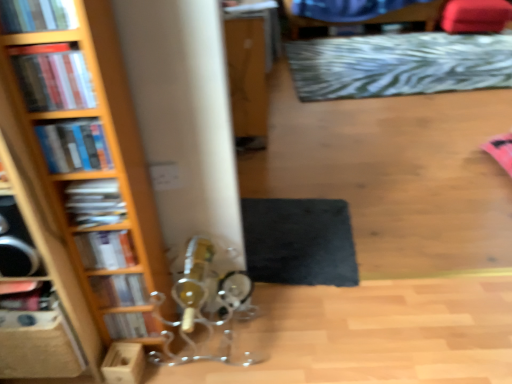
At what (x,y) coordinates should I click in order to perform the action: click on vacant region above black felt mat at lower center, positioned as the second mat in top-to-bottom order (from a real-world perspective). Please return your answer as a coordinate pair (x, y). The image size is (512, 384). Looking at the image, I should click on (295, 233).